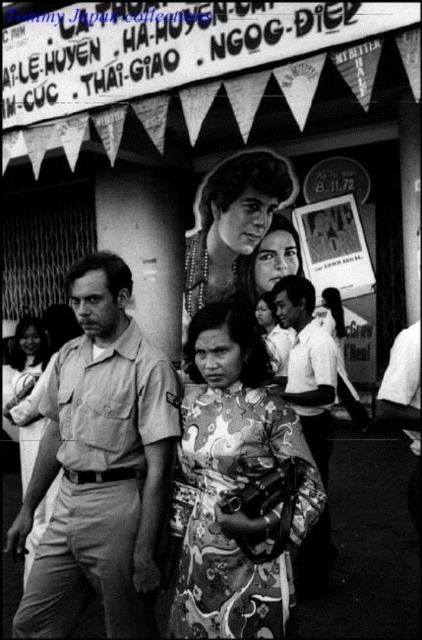
From the picture: Is printed paper poster at center positioned at the back of floral fabric dress at lower center?

Yes, it is behind floral fabric dress at lower center.

Does printed paper poster at center appear under floral fabric dress at lower center?

No, printed paper poster at center is not below floral fabric dress at lower center.

Between point (343, 298) and point (42, 420), which one is positioned in front?

Point (42, 420)

I want to click on printed paper poster at center, so click(x=335, y=246).

Between light beige uniform at center and floral fabric dress at lower center, which one appears on the left side from the viewer's perspective?

floral fabric dress at lower center

Does light beige uniform at center appear on the left side of floral fabric dress at lower center?

Incorrect, light beige uniform at center is not on the left side of floral fabric dress at lower center.

Does point (81, 305) come behind point (42, 433)?

No, (81, 305) is in front of (42, 433).

This screenshot has width=422, height=640. Identify the location of light beige uniform at center. (100, 465).

Can you confirm if floral silk dress at center is positioned to the left of printed paper poster at center?

Yes, floral silk dress at center is to the left of printed paper poster at center.

Does floral silk dress at center have a lesser height compared to printed paper poster at center?

Incorrect, floral silk dress at center's height does not fall short of printed paper poster at center's.

This screenshot has height=640, width=422. I want to click on floral silk dress at center, so click(234, 483).